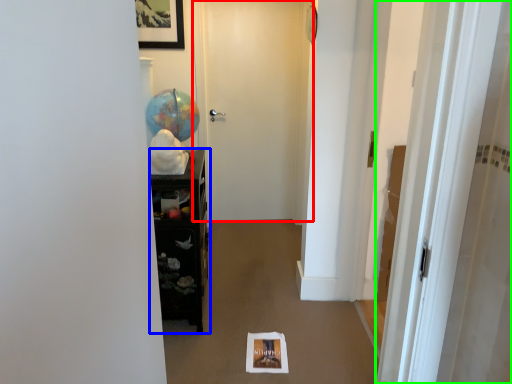
Question: Which object is the farthest from door (highlighted by a red box)? Choose among these: furniture (highlighted by a blue box) or door (highlighted by a green box).

Choices:
 (A) furniture
 (B) door

Answer: (B)